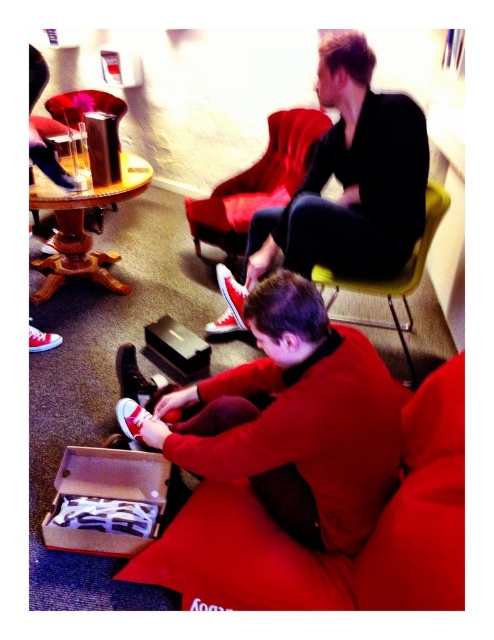
Question: Observing the image, what is the correct spatial positioning of velvet red couch at lower center in reference to shiny metallic shoe at center?

Choices:
 (A) left
 (B) right

Answer: (B)

Question: Can you confirm if matte black shirt at upper center is wider than red suede shoe at lower center?

Choices:
 (A) yes
 (B) no

Answer: (A)

Question: Observing the image, what is the correct spatial positioning of velvet red armchair at upper center in reference to red canvas shoe at lower left?

Choices:
 (A) above
 (B) below

Answer: (A)

Question: Which of the following is the closest to the observer?

Choices:
 (A) (187, 364)
 (B) (382, 100)
 (C) (248, 492)

Answer: (C)

Question: Which is farther from the yellow fabric armchair at center?

Choices:
 (A) shiny red sneakers at center
 (B) red canvas shoe at lower left

Answer: (B)

Question: Which of the following is the closest to the observer?

Choices:
 (A) (240, 316)
 (B) (40, 344)

Answer: (A)